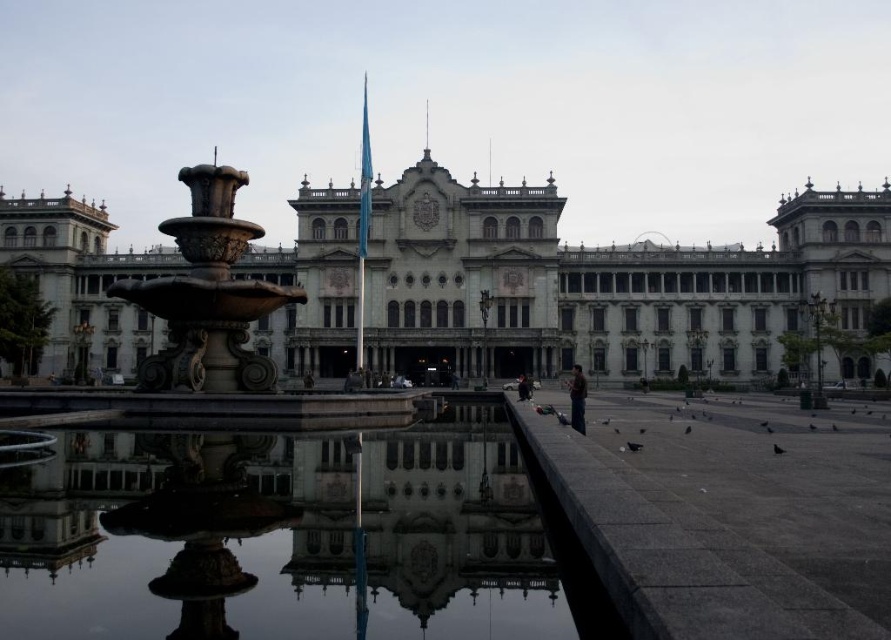
You are standing in the plaza in front of the stone building at center. You want to walk towards the stone fountain at center. Which direction should you face to approach the fountain directly?

Since the stone fountain at center is located below the stone building at center, you should face downward or towards the lower part of the plaza to approach the fountain directly.

You are an architect designing a new plaza layout. You need to place a statue that requires a base of 3 meters in diameter. The statue must be placed on either the stone fountain at center or the reflective glass water at center. Which location can accommodate the statue?

The stone fountain at center is bigger than reflective glass water at center, so the statue can be placed on the stone fountain at center as it has sufficient space for the 3 meters diameter base.